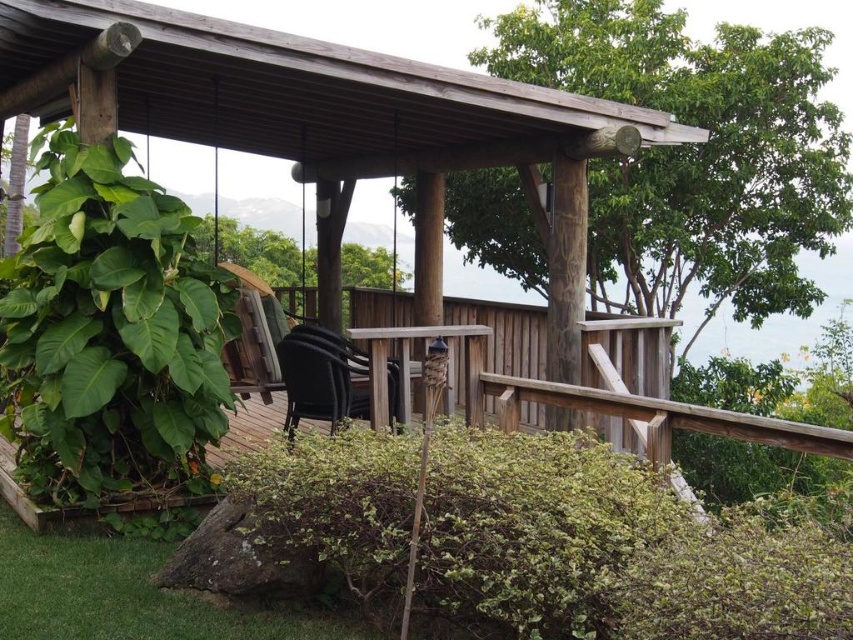
Question: Does wooden gazebo at center have a greater width compared to matte black chair at center?

Choices:
 (A) yes
 (B) no

Answer: (A)

Question: In this image, where is wooden gazebo at center located relative to matte black chair at center?

Choices:
 (A) below
 (B) above

Answer: (B)

Question: Which point is closer to the camera taking this photo?

Choices:
 (A) (236, 244)
 (B) (155, 410)

Answer: (B)

Question: In this image, where is green leafy plant at left located relative to matte black chair at center?

Choices:
 (A) below
 (B) above

Answer: (B)

Question: Which object appears closest to the camera in this image?

Choices:
 (A) matte black chair at center
 (B) green leafy tree at center
 (C) wooden gazebo at center
 (D) green leafy tree at upper right

Answer: (A)

Question: Which point is closer to the camera taking this photo?

Choices:
 (A) (222, 259)
 (B) (96, 208)

Answer: (B)